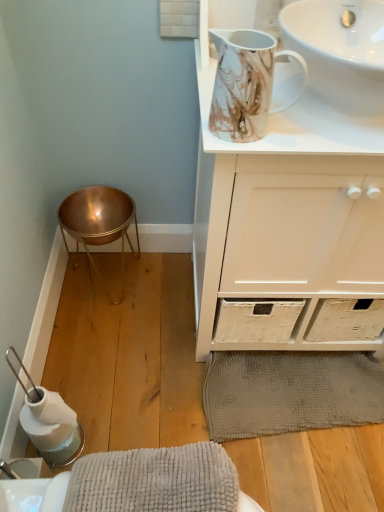
Question: From a real-world perspective, is white glossy sink at upper right, the first sink positioned from the top, above or below white matte cabinet at upper center?

Choices:
 (A) below
 (B) above

Answer: (B)

Question: Would you say white glossy sink at upper right, the first sink positioned from the top, is to the left or to the right of white matte cabinet at upper center in the picture?

Choices:
 (A) right
 (B) left

Answer: (A)

Question: Which of these objects is positioned closest to the white glossy sink at upper right, which appears as the 2th sink when ordered from the bottom?

Choices:
 (A) gray textured bath mat at lower center
 (B) white glossy sink at upper right, placed as the second sink when sorted from top to bottom
 (C) white matte cabinet at upper center
 (D) copper/metallic bar stool at lower left

Answer: (B)

Question: Which is nearer to the white glossy sink at upper right, the first sink positioned from the top?

Choices:
 (A) white glossy sink at upper right, placed as the 1th sink when sorted from bottom to top
 (B) copper/metallic bar stool at lower left
 (C) gray textured bath mat at lower center
 (D) white matte cabinet at upper center

Answer: (A)